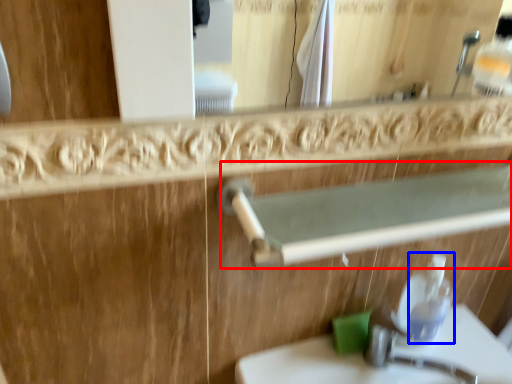
Question: Which of the following is the farthest to the observer, balustrade (highlighted by a red box) or soap dispenser (highlighted by a blue box)?

Choices:
 (A) balustrade
 (B) soap dispenser

Answer: (B)